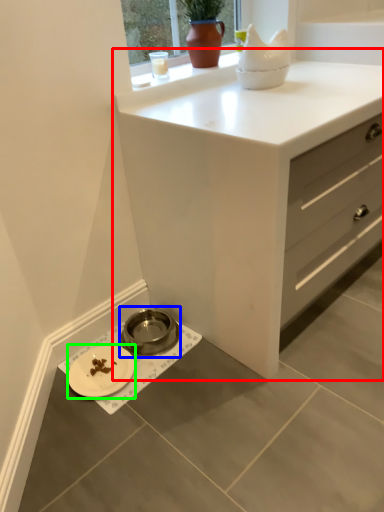
Question: Which object is the closest to the chest of drawers (highlighted by a red box)? Choose among these: appliance (highlighted by a blue box) or platter (highlighted by a green box).

Choices:
 (A) appliance
 (B) platter

Answer: (A)